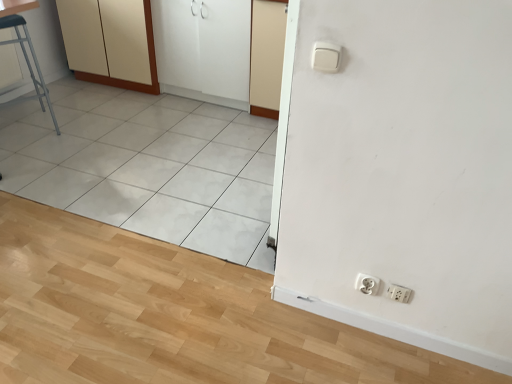
Question: Are white plastic socket at lower right, which is counted as the first socket, starting from the left, and white glossy cabinet at upper left, which is counted as the 2th screen door, starting from the right, beside each other?

Choices:
 (A) yes
 (B) no

Answer: (B)

Question: Is white plastic socket at lower right, which is counted as the first socket, starting from the left, turned away from white glossy cabinet at upper left, arranged as the 1th screen door when viewed from the left?

Choices:
 (A) no
 (B) yes

Answer: (A)

Question: Is white glossy cabinet at upper left, arranged as the 1th screen door when viewed from the left, located within white plastic socket at lower right, which is counted as the first socket, starting from the left?

Choices:
 (A) yes
 (B) no

Answer: (B)

Question: Is white plastic socket at lower right, which is counted as the first socket, starting from the left, taller than white glossy cabinet at upper left, arranged as the 1th screen door when viewed from the left?

Choices:
 (A) no
 (B) yes

Answer: (A)

Question: Is white plastic socket at lower right, which is counted as the second socket, starting from the right, shorter than white glossy cabinet at upper left, arranged as the 1th screen door when viewed from the left?

Choices:
 (A) no
 (B) yes

Answer: (B)

Question: From a real-world perspective, is white matte screen door at upper center, which appears as the first screen door when viewed from the right, physically located above or below metallic stool at left?

Choices:
 (A) above
 (B) below

Answer: (A)

Question: Would you say white matte screen door at upper center, which ranks as the second screen door in left-to-right order, is to the left or to the right of metallic stool at left in the picture?

Choices:
 (A) left
 (B) right

Answer: (B)

Question: From their relative heights in the image, would you say white matte screen door at upper center, which appears as the first screen door when viewed from the right, is taller or shorter than metallic stool at left?

Choices:
 (A) tall
 (B) short

Answer: (A)

Question: Looking at the image, does white matte screen door at upper center, which appears as the first screen door when viewed from the right, seem bigger or smaller compared to metallic stool at left?

Choices:
 (A) small
 (B) big

Answer: (A)

Question: Is point (69, 21) closer or farther from the camera than point (408, 296)?

Choices:
 (A) closer
 (B) farther

Answer: (B)

Question: From a real-world perspective, is matte cream cabinet at upper left above or below white plastic socket at lower right, placed as the first socket when sorted from right to left?

Choices:
 (A) above
 (B) below

Answer: (A)

Question: In terms of height, does matte cream cabinet at upper left look taller or shorter compared to white plastic socket at lower right, placed as the first socket when sorted from right to left?

Choices:
 (A) short
 (B) tall

Answer: (B)

Question: Based on their sizes in the image, would you say matte cream cabinet at upper left is bigger or smaller than white plastic socket at lower right, which ranks as the second socket in left-to-right order?

Choices:
 (A) big
 (B) small

Answer: (A)

Question: Considering the positions of metallic stool at left and white matte screen door at upper center, which ranks as the second screen door in left-to-right order, in the image, is metallic stool at left wider or thinner than white matte screen door at upper center, which ranks as the second screen door in left-to-right order,?

Choices:
 (A) thin
 (B) wide

Answer: (A)

Question: Is metallic stool at left to the left or to the right of white matte screen door at upper center, which ranks as the second screen door in left-to-right order, in the image?

Choices:
 (A) right
 (B) left

Answer: (B)